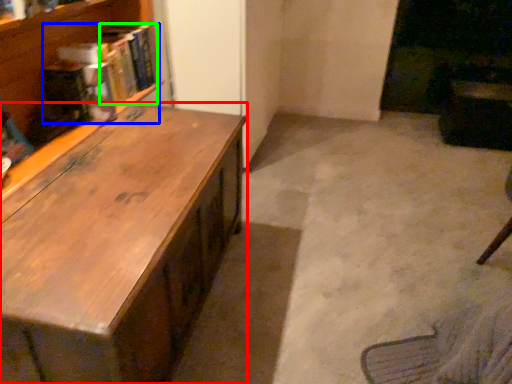
Question: Estimate the real-world distances between objects in this image. Which object is closer to desk (highlighted by a red box), book (highlighted by a blue box) or book (highlighted by a green box)?

Choices:
 (A) book
 (B) book

Answer: (A)